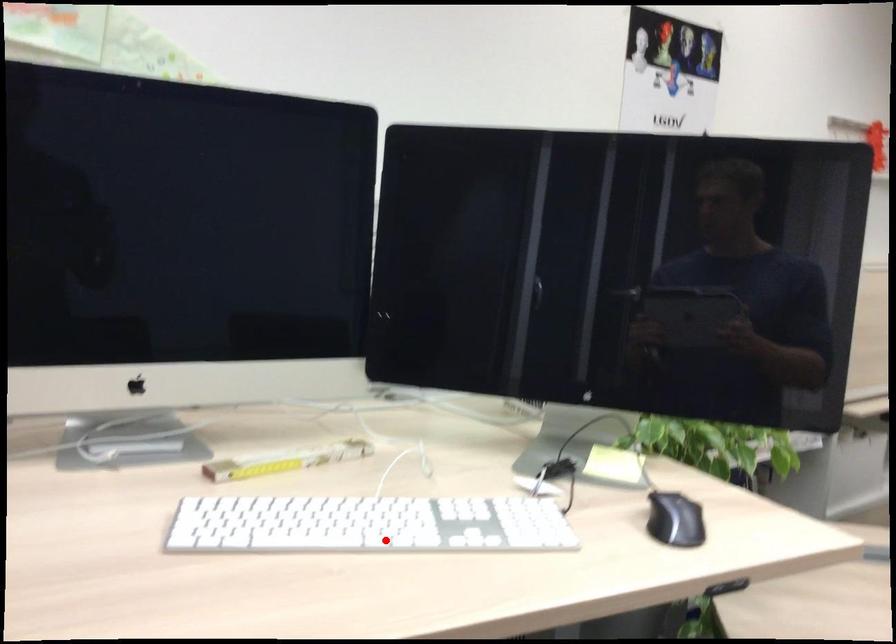
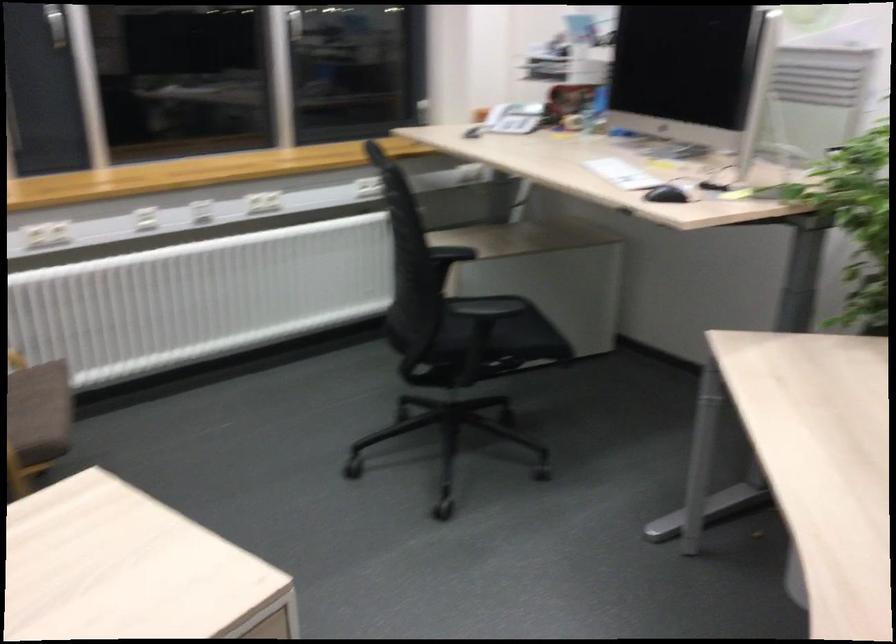
Question: A red point is marked in image1. In image2, is the corresponding 3D point closer to the camera or farther? Reply with the corresponding letter.

Choices:
 (A) The corresponding 3D point is closer.
 (B) The corresponding 3D point is farther.

Answer: (B)